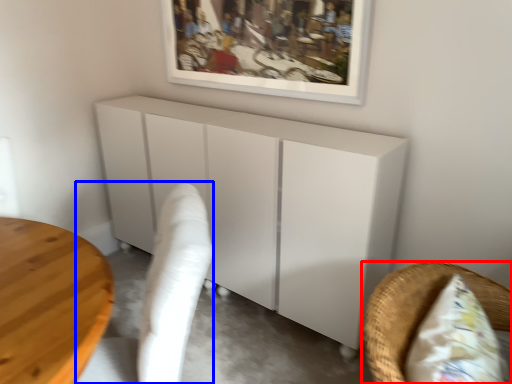
Question: Which of the following is the farthest to the observer, furniture (highlighted by a red box) or swivel chair (highlighted by a blue box)?

Choices:
 (A) furniture
 (B) swivel chair

Answer: (B)